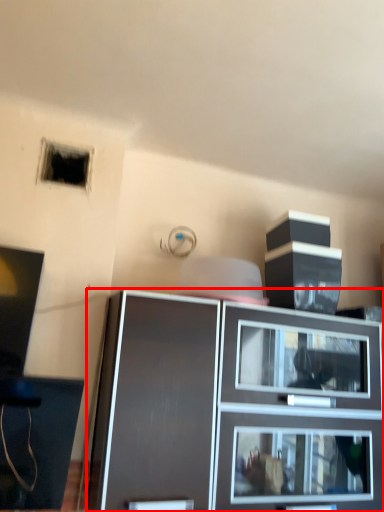
Question: Where is cabinetry (annotated by the red box) located in relation to hole in the image?

Choices:
 (A) left
 (B) right

Answer: (B)